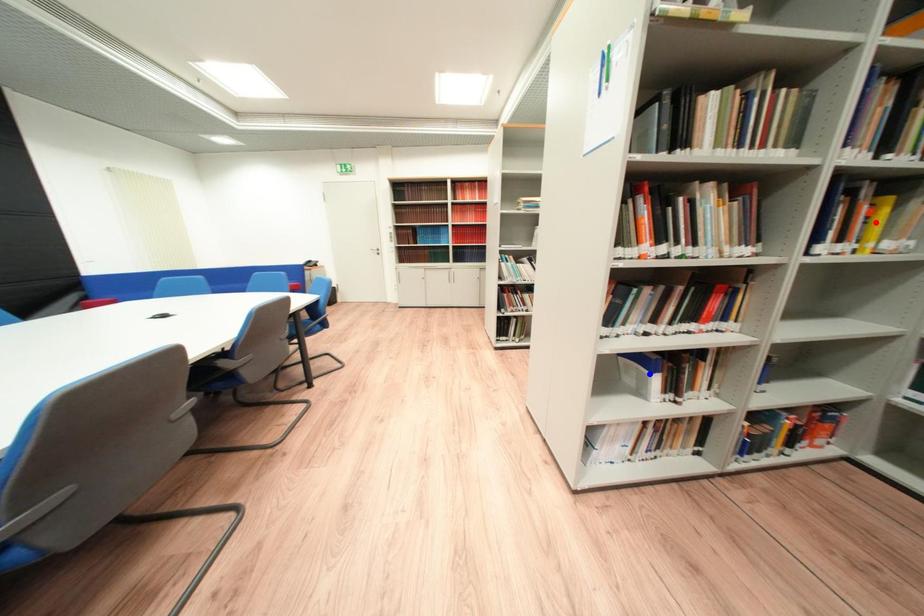
Question: Two points are marked on the image. Which point is closer to the camera?

Choices:
 (A) Blue point is closer.
 (B) Red point is closer.

Answer: (B)